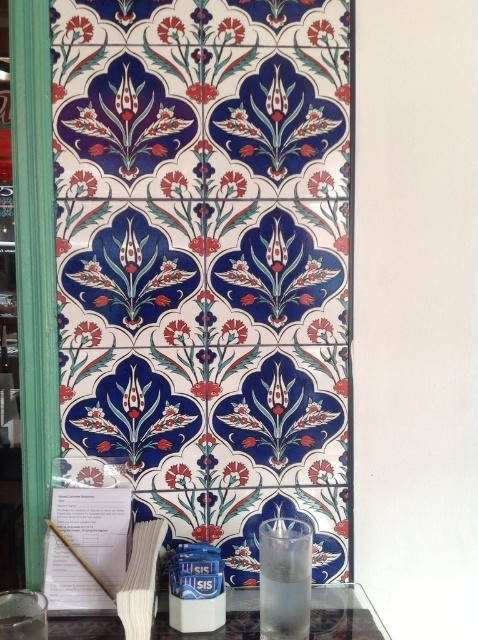
In the scene shown: Can you confirm if porcelain tiles at center is thinner than transparent glass at lower center?

Correct, porcelain tiles at center's width is less than transparent glass at lower center's.

Who is positioned more to the left, porcelain tiles at center or transparent glass at lower center?

Positioned to the left is porcelain tiles at center.

You are a GUI agent. You are given a task and a screenshot of the screen. Output one action in this format:
    pyautogui.click(x=<x>, y=<y>)
    Task: Click on the porcelain tiles at center
    The height and width of the screenshot is (640, 478).
    Given the screenshot: What is the action you would take?
    pyautogui.click(x=207, y=260)